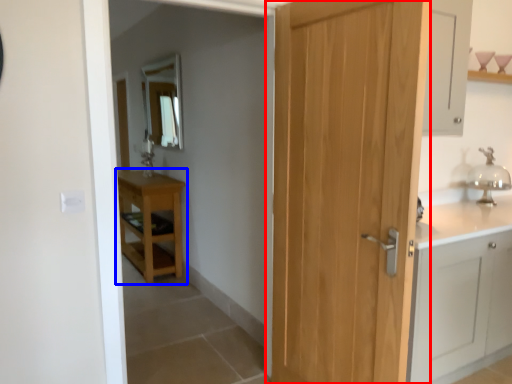
Question: Among these objects, which one is farthest to the camera, door (highlighted by a red box) or table (highlighted by a blue box)?

Choices:
 (A) door
 (B) table

Answer: (B)